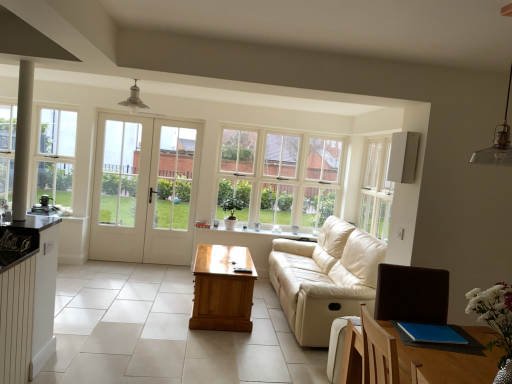
What is the approximate width of white plastic air purifier at upper right, the 1th appliance in the right-to-left sequence?

white plastic air purifier at upper right, the 1th appliance in the right-to-left sequence, is 10.76 centimeters wide.

The width and height of the screenshot is (512, 384). Describe the element at coordinates (144, 190) in the screenshot. I see `white glass door at center` at that location.

What is the approximate width of light brown wooden table at center?

light brown wooden table at center is 24.79 inches wide.

Find the location of `light brown wooden table at center`. light brown wooden table at center is located at coordinates (222, 289).

Identify the location of white plastic air purifier at upper right, which is the second appliance from back to front. This screenshot has width=512, height=384. (403, 157).

Are clear glass window at center, arranged as the second window when viewed from the left, and white glass door at center far apart?

Yes, clear glass window at center, arranged as the second window when viewed from the left, and white glass door at center are located far from each other.

Can you tell me how much clear glass window at center, which ranks as the first window in back-to-front order, and white glass door at center differ in facing direction?

clear glass window at center, which ranks as the first window in back-to-front order, and white glass door at center are facing 0.51 degrees away from each other.

Which is closer, (249, 184) or (137, 250)?

Point (249, 184) is positioned farther from the camera compared to point (137, 250).

Which is behind, clear glass window at center, arranged as the second window when viewed from the left, or white glass door at center?

clear glass window at center, arranged as the second window when viewed from the left, is further away from the camera.

Are white plastic air purifier at upper right, which is the second appliance from back to front, and metallic pendant light at upper right making contact?

No.

From the picture: From a real-world perspective, which is physically below, white plastic air purifier at upper right, the 1th appliance in the right-to-left sequence, or metallic pendant light at upper right?

From a 3D spatial view, white plastic air purifier at upper right, the 1th appliance in the right-to-left sequence, is below.

In the scene shown: How distant is white plastic air purifier at upper right, positioned as the first appliance in top-to-bottom order, from metallic pendant light at upper right?

They are 3.56 feet apart.

Does point (406, 166) lie behind point (481, 156)?

Yes, point (406, 166) is farther from viewer.

Would you say beige leather couch at center is inside or outside white glass door at center?

beige leather couch at center lies outside white glass door at center.

Does beige leather couch at center come behind white glass door at center?

No, it is in front of white glass door at center.

Considering the relative sizes of beige leather couch at center and white glass door at center in the image provided, is beige leather couch at center bigger than white glass door at center?

Yes, beige leather couch at center is bigger than white glass door at center.

From a real-world perspective, between beige leather couch at center and white glass door at center, who is vertically lower?

In real-world perspective, beige leather couch at center is lower.

From a real-world perspective, is metallic pendant light at upper right above or below light brown wooden table at center?

metallic pendant light at upper right is situated higher than light brown wooden table at center in the real world.

The image size is (512, 384). Find the location of `lamp on the right of light brown wooden table at center`. lamp on the right of light brown wooden table at center is located at coordinates (497, 142).

Is point (508, 134) farther from viewer compared to point (198, 319)?

No, it is in front of (198, 319).

Considering the relative positions of matte black coffee machine at left, marked as the 2th appliance in a front-to-back arrangement, and light brown wooden table at center in the image provided, is matte black coffee machine at left, marked as the 2th appliance in a front-to-back arrangement, to the left or to the right of light brown wooden table at center?

Clearly, matte black coffee machine at left, marked as the 2th appliance in a front-to-back arrangement, is on the left of light brown wooden table at center in the image.

Is matte black coffee machine at left, marked as the first appliance in a bottom-to-top arrangement, far away from light brown wooden table at center?

That's right, there is a large distance between matte black coffee machine at left, marked as the first appliance in a bottom-to-top arrangement, and light brown wooden table at center.

Locate an element on the screen. Image resolution: width=512 pixels, height=384 pixels. appliance behind the light brown wooden table at center is located at coordinates (44, 206).

Is light brown wooden table at center taller or shorter than clear glass window at center, which is the first window from right to left?

Clearly, light brown wooden table at center is shorter compared to clear glass window at center, which is the first window from right to left.

Does point (225, 258) lie behind point (295, 161)?

No, (225, 258) is closer to viewer.

Is light brown wooden table at center located outside clear glass window at center, which ranks as the first window in back-to-front order?

Yes, light brown wooden table at center is located beyond the bounds of clear glass window at center, which ranks as the first window in back-to-front order.

Considering the sizes of objects light brown wooden table at center and clear glass window at center, which ranks as the first window in back-to-front order, in the image provided, who is bigger, light brown wooden table at center or clear glass window at center, which ranks as the first window in back-to-front order,?

light brown wooden table at center is bigger.

Are matte black coffee machine at left, acting as the 1th appliance starting from the left, and clear glass window at center, arranged as the second window when viewed from the front, located far from each other?

Indeed, matte black coffee machine at left, acting as the 1th appliance starting from the left, is not near clear glass window at center, arranged as the second window when viewed from the front.

Can you tell me how much matte black coffee machine at left, arranged as the first appliance when viewed from the back, and clear glass window at center, which is the first window from right to left, differ in facing direction?

1.52 degrees.

Is clear glass window at center, which is the first window from right to left, completely or partially inside matte black coffee machine at left, marked as the 2th appliance in a front-to-back arrangement?

Definitely not — clear glass window at center, which is the first window from right to left, is not inside matte black coffee machine at left, marked as the 2th appliance in a front-to-back arrangement.

Is matte black coffee machine at left, arranged as the first appliance when viewed from the back, taller than clear glass window at center, which ranks as the first window in back-to-front order?

No, matte black coffee machine at left, arranged as the first appliance when viewed from the back, is not taller than clear glass window at center, which ranks as the first window in back-to-front order.

From the image's perspective, which window is the 1st one above the white glass door at center? Please provide its 2D coordinates.

[(280, 178)]

There is a metallic pendant light at upper right. Identify the location of the 1st appliance below it (from the image's perspective). (403, 157).

Estimate the real-world distances between objects in this image. Which object is further from white glass door at center, white plastic air purifier at upper right, which is the second appliance from back to front, or clear glass window at center, arranged as the second window when viewed from the front?

white plastic air purifier at upper right, which is the second appliance from back to front.

Considering their positions, is beige leather couch at center positioned closer to white plastic air purifier at upper right, arranged as the 2th appliance when ordered from the bottom, than white glass door at center?

Among the two, beige leather couch at center is located nearer to white plastic air purifier at upper right, arranged as the 2th appliance when ordered from the bottom.

Which object lies further to the anchor point white glass door at center, beige leather couch at center or metallic pendant light at upper right?

metallic pendant light at upper right.

Estimate the real-world distances between objects in this image. Which object is further from matte black coffee machine at left, acting as the 1th appliance starting from the left, white plastic air purifier at upper right, the 1th appliance in the right-to-left sequence, or light brown wooden table at center?

white plastic air purifier at upper right, the 1th appliance in the right-to-left sequence, is positioned further to the anchor matte black coffee machine at left, acting as the 1th appliance starting from the left.

Based on their spatial positions, is white glass door at center or beige leather couch at center closer to light brown wooden table at center?

beige leather couch at center is positioned closer to the anchor light brown wooden table at center.

Looking at the image, which one is located closer to white glass door at center, white glass door at center or white plastic air purifier at upper right, which is the second appliance from back to front?

Based on the image, white glass door at center appears to be nearer to white glass door at center.

From the image, which object appears to be farther from light brown wooden table at center, white glass door at center or white glass door at center?

white glass door at center.

Which object lies further to the anchor point light brown wooden table at center, metallic pendant light at upper right or beige leather couch at center?

Based on the image, metallic pendant light at upper right appears to be further to light brown wooden table at center.

At what (x,y) coordinates should I click in order to perform the action: click on door between metallic pendant light at upper right and clear glass window at center, which ranks as the first window in back-to-front order, from front to back. Please return your answer as a coordinate pair (x, y). The width and height of the screenshot is (512, 384). Looking at the image, I should click on (144, 190).

Where is `table located between clear glass window at left, which appears as the 2th window when viewed from the back, and white plastic air purifier at upper right, the first appliance when ordered from front to back, in the left-right direction`? table located between clear glass window at left, which appears as the 2th window when viewed from the back, and white plastic air purifier at upper right, the first appliance when ordered from front to back, in the left-right direction is located at coordinates (222, 289).

Where is `studio couch between clear glass window at left, which appears as the 2th window when viewed from the back, and metallic pendant light at upper right, in the horizontal direction`? The height and width of the screenshot is (384, 512). studio couch between clear glass window at left, which appears as the 2th window when viewed from the back, and metallic pendant light at upper right, in the horizontal direction is located at coordinates (325, 278).

Find the location of a particular element. This screenshot has width=512, height=384. table between clear glass window at left, which appears as the 2th window when viewed from the back, and metallic pendant light at upper right is located at coordinates (222, 289).